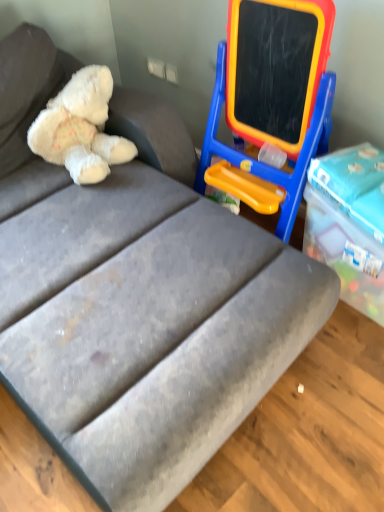
Question: Is point (84, 158) positioned closer to the camera than point (291, 16)?

Choices:
 (A) farther
 (B) closer

Answer: (A)

Question: From the image's perspective, relative to blue plastic easel at upper right, is white plush teddy bear at upper left above or below?

Choices:
 (A) above
 (B) below

Answer: (A)

Question: In the image, is white plush teddy bear at upper left positioned in front of or behind blue plastic easel at upper right?

Choices:
 (A) behind
 (B) front

Answer: (A)

Question: Relative to white plush teddy bear at upper left, is blue plastic easel at upper right in front or behind?

Choices:
 (A) front
 (B) behind

Answer: (A)

Question: Is blue plastic easel at upper right taller or shorter than white plush teddy bear at upper left?

Choices:
 (A) tall
 (B) short

Answer: (A)

Question: Visually, is blue plastic easel at upper right positioned to the left or to the right of white plush teddy bear at upper left?

Choices:
 (A) left
 (B) right

Answer: (B)

Question: Considering the positions of blue plastic easel at upper right and white plush teddy bear at upper left in the image, is blue plastic easel at upper right wider or thinner than white plush teddy bear at upper left?

Choices:
 (A) wide
 (B) thin

Answer: (B)